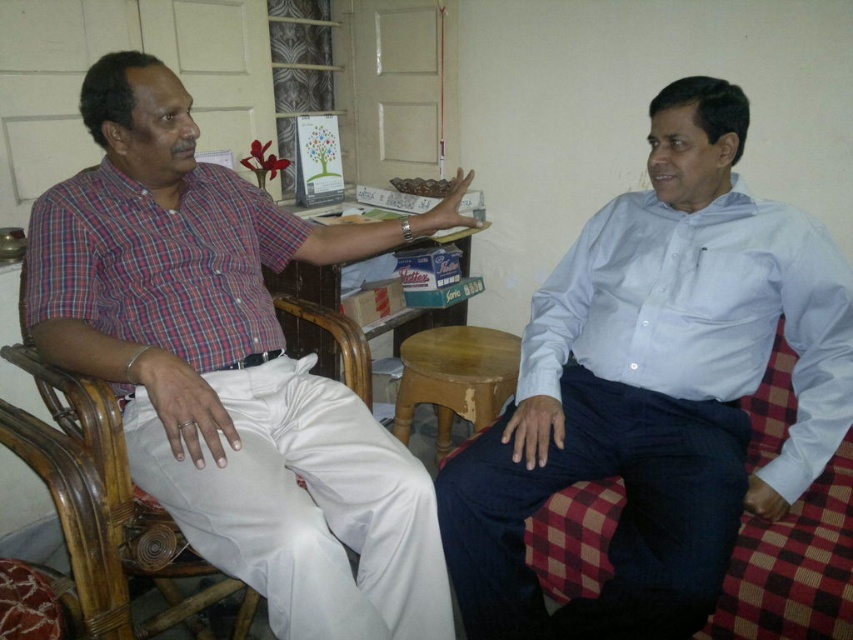
Question: Is checkered fabric armchair at right positioned at the back of white fabric armchair at left?

Choices:
 (A) no
 (B) yes

Answer: (B)

Question: Can you confirm if light blue cotton shirt at right is positioned to the right of white fabric armchair at left?

Choices:
 (A) no
 (B) yes

Answer: (B)

Question: Which is nearer to the checkered fabric armchair at right?

Choices:
 (A) matte plaid shirt at left
 (B) wooden stool at center

Answer: (B)

Question: Which of the following is the closest to the observer?

Choices:
 (A) matte plaid shirt at left
 (B) light blue cotton shirt at right

Answer: (A)

Question: Considering the real-world distances, which object is farthest from the white fabric armchair at left?

Choices:
 (A) matte plaid shirt at left
 (B) light blue cotton shirt at right

Answer: (B)

Question: Is white fabric armchair at left to the left of wooden stool at center from the viewer's perspective?

Choices:
 (A) yes
 (B) no

Answer: (A)